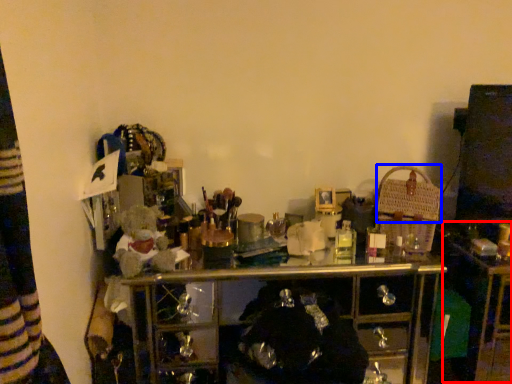
Question: Which point is closer to the camera, computer desk (highlighted by a red box) or basket (highlighted by a blue box)?

Choices:
 (A) computer desk
 (B) basket

Answer: (A)